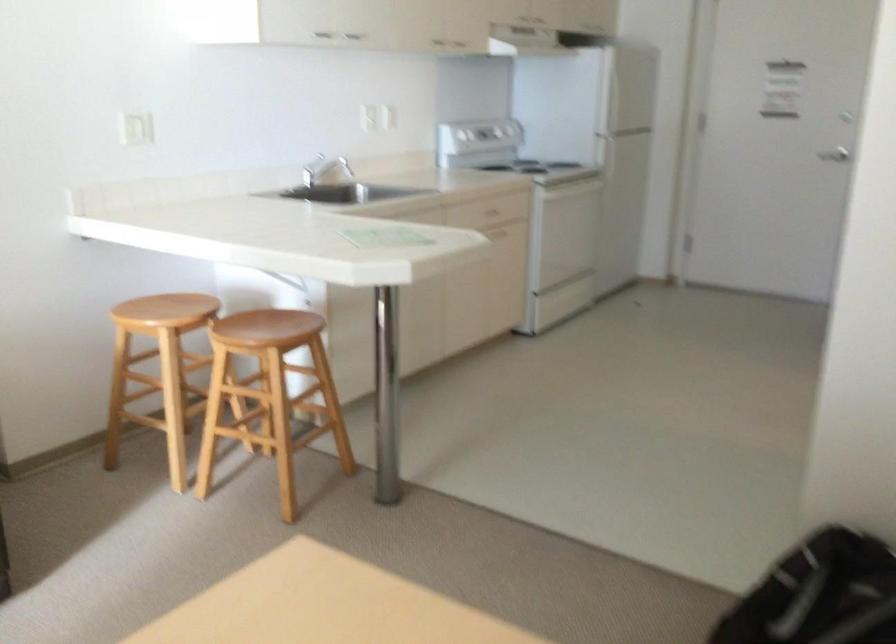
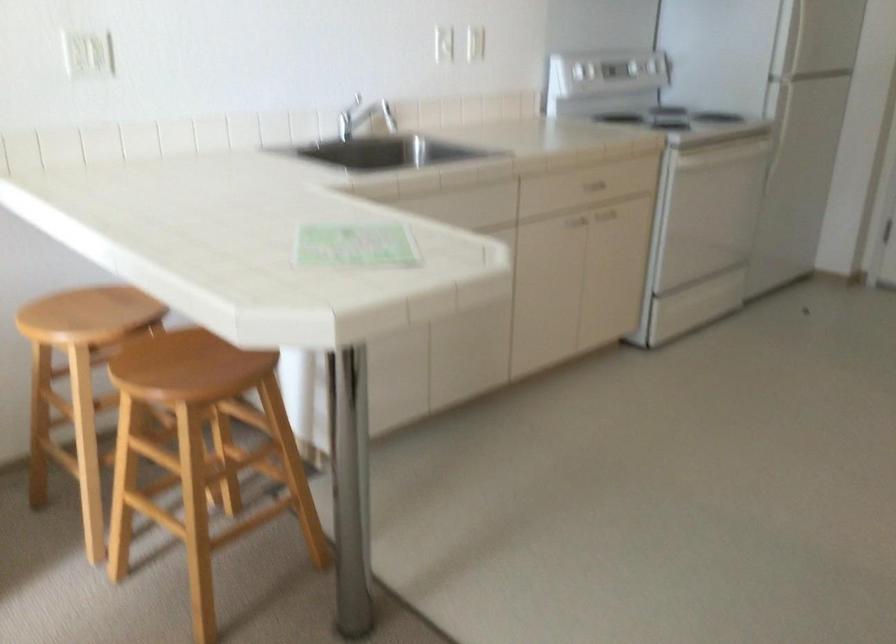
Find the pixel in the second image that matches [483,124] in the first image.

(609, 71)